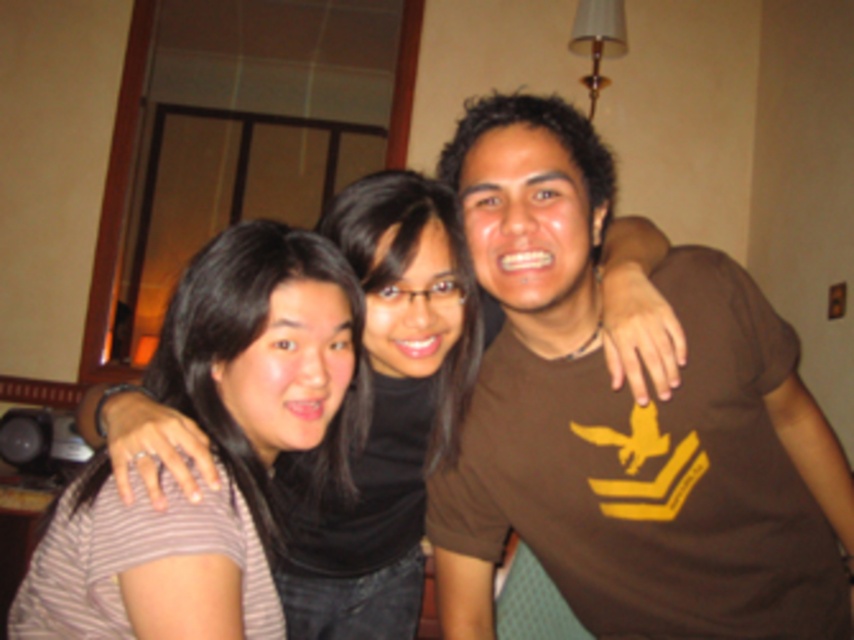
Question: Which point appears closest to the camera in this image?

Choices:
 (A) (147, 620)
 (B) (398, 252)

Answer: (A)

Question: In this image, where is brown matte t-shirt at center located relative to striped fabric shirt at left?

Choices:
 (A) right
 (B) left

Answer: (A)

Question: Can you confirm if striped fabric shirt at left is positioned below matte striped shirt at left?

Choices:
 (A) no
 (B) yes

Answer: (B)

Question: Among these objects, which one is nearest to the camera?

Choices:
 (A) matte striped shirt at left
 (B) brown matte t-shirt at center
 (C) striped fabric shirt at left

Answer: (C)

Question: Which point appears farthest from the camera in this image?

Choices:
 (A) (613, 273)
 (B) (192, 564)
 (C) (542, 406)

Answer: (C)

Question: Is striped fabric shirt at left to the right of matte striped shirt at left from the viewer's perspective?

Choices:
 (A) no
 (B) yes

Answer: (A)